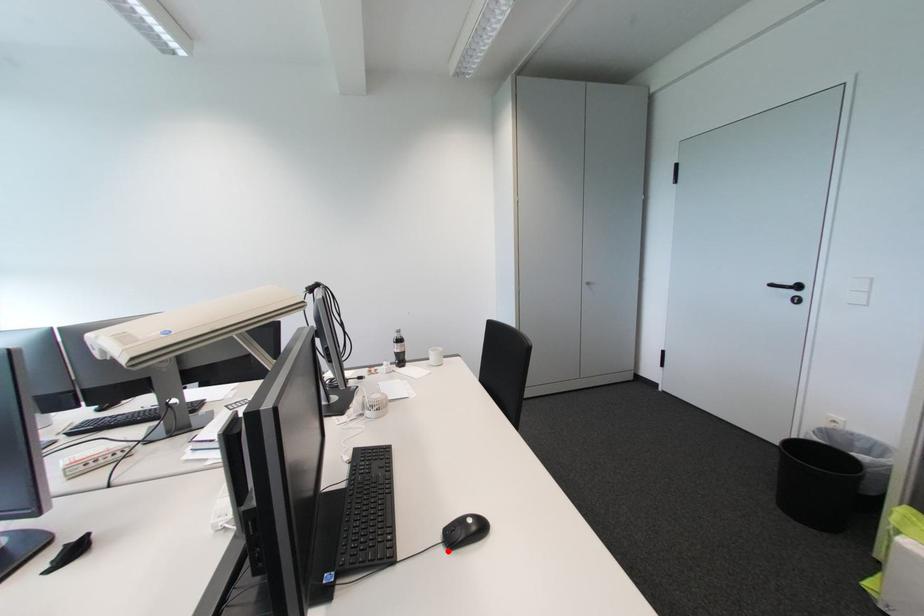
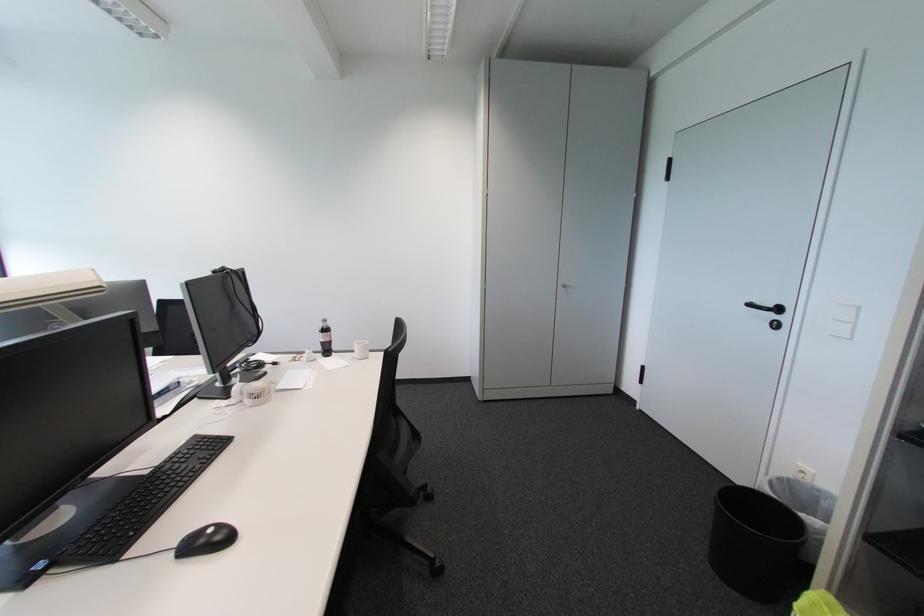
Find the pixel in the second image that matches the highlighted location in the first image.

(177, 557)